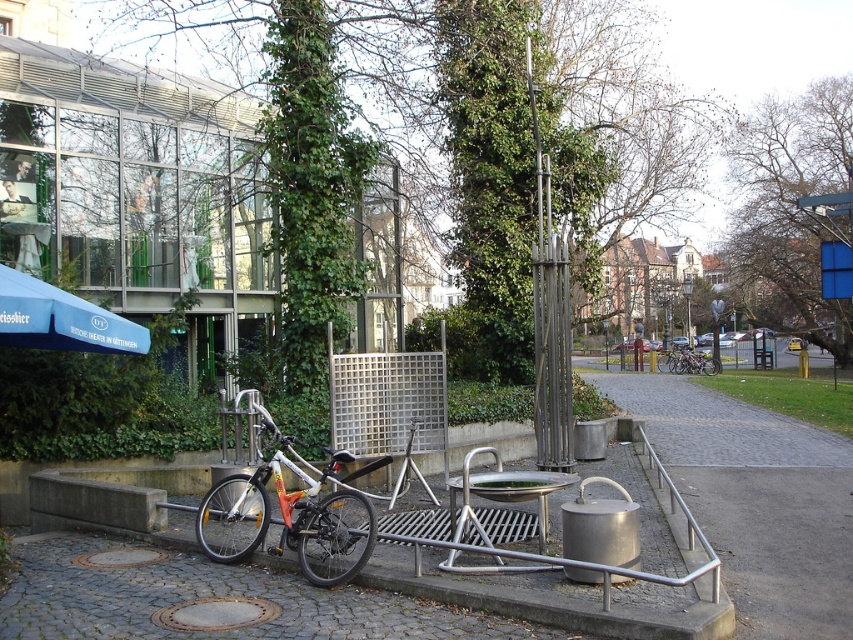
Does white matte bicycle at center have a greater width compared to shiny silver bicycle at center?

Correct, the width of white matte bicycle at center exceeds that of shiny silver bicycle at center.

Find the location of a particular element. The image size is (853, 640). white matte bicycle at center is located at coordinates (288, 515).

Who is more forward, [322,499] or [695,356]?

Point [322,499] is more forward.

Locate an element on the screen. The height and width of the screenshot is (640, 853). white matte bicycle at center is located at coordinates (288, 515).

Does point (312, 554) lie behind point (84, 304)?

No.

Can you confirm if white matte bicycle at center is taller than blue fabric umbrella at left?

Yes.

Which is in front, point (260, 493) or point (61, 340)?

Point (260, 493) is in front.

This screenshot has width=853, height=640. What are the coordinates of `white matte bicycle at center` in the screenshot? It's located at (288, 515).

Does blue fabric umbrella at left appear on the right side of shiny silver bicycle at center?

In fact, blue fabric umbrella at left is to the left of shiny silver bicycle at center.

Does blue fabric umbrella at left appear on the left side of shiny silver bicycle at center?

Yes, blue fabric umbrella at left is to the left of shiny silver bicycle at center.

Where is `blue fabric umbrella at left`? This screenshot has height=640, width=853. blue fabric umbrella at left is located at coordinates (61, 320).